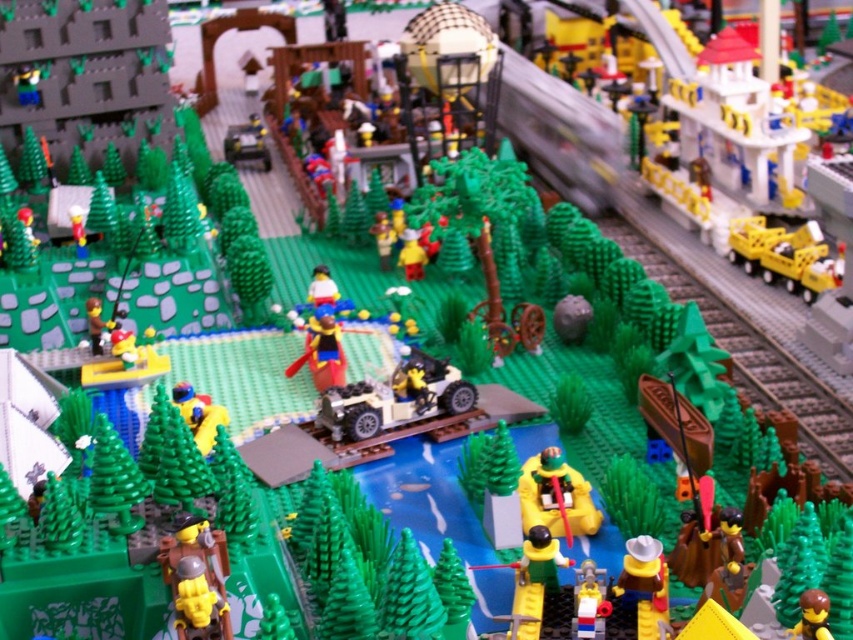
You are a Lego figure standing on the edge of the water and want to reach the matte yellow cowboy hat at lower right. The yellow matte boat at center is in your path. Can you walk around the boat to reach the hat?

The distance between the yellow matte boat at center and the matte yellow cowboy hat at lower right is 5.57 inches. Since the boat is in your path, you would need to navigate around it. However, the exact path and space required to maneuver around the boat isn

You are a Lego figure standing at the edge of the water. You see the smooth yellow boat at center and the smooth plastic figure at lower center. Which object is closer to your right side?

The smooth plastic figure at lower center is closer to your right side because the smooth yellow boat at center is positioned to its left.

You are a Lego figure standing at point (556, 497). What object is directly beneath you?

The yellow matte boat at center is located at point (556, 497), so the object directly beneath you is the yellow matte boat at center.